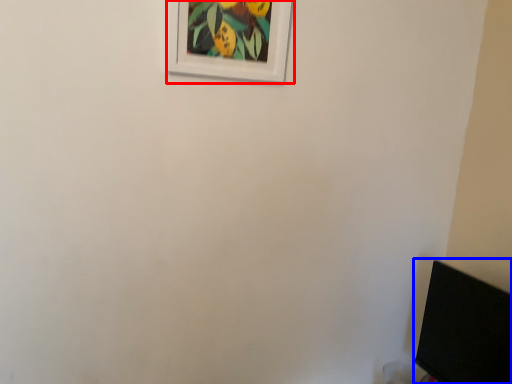
Question: Which point is closer to the camera, picture frame (highlighted by a red box) or computer monitor (highlighted by a blue box)?

Choices:
 (A) picture frame
 (B) computer monitor

Answer: (B)